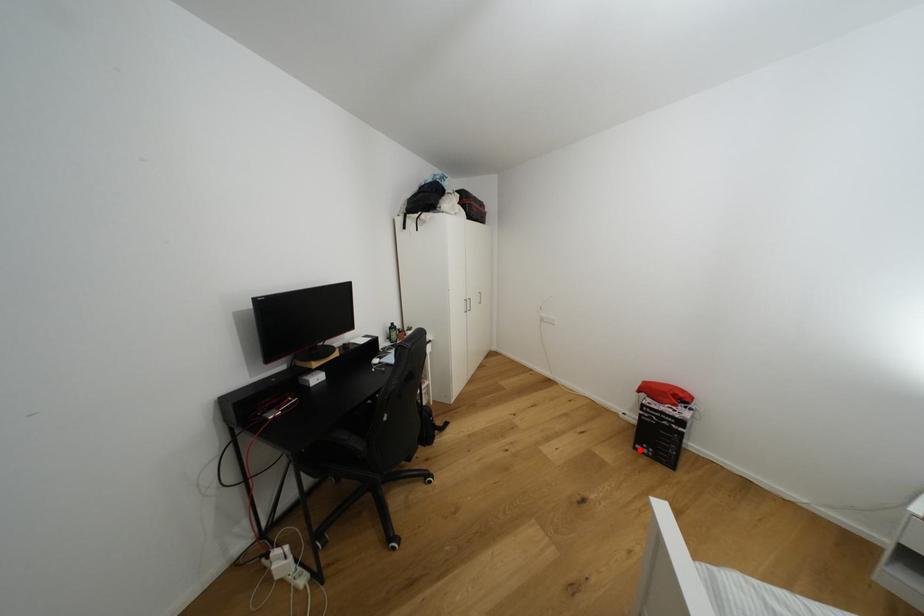
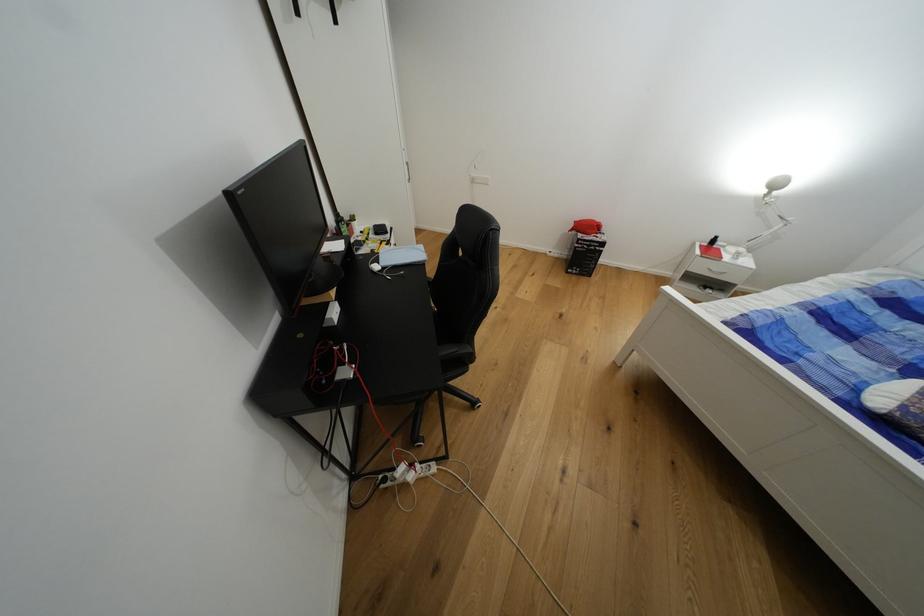
Question: I am providing you with two images of the same scene from different viewpoints. Given a red point in image1, look at the same physical point in image2. Is it:

Choices:
 (A) Closer to the viewpoint
 (B) Farther from the viewpoint

Answer: (A)